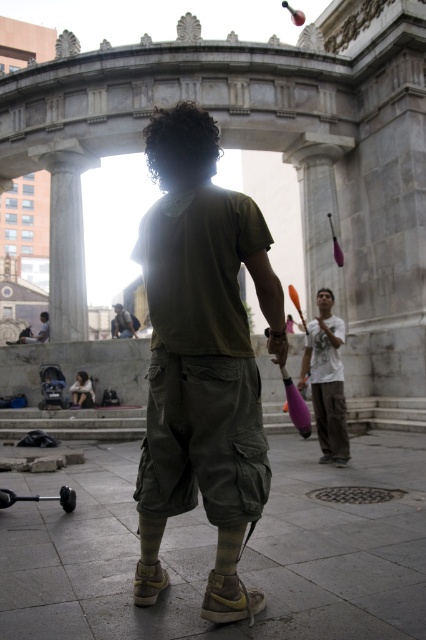
Between curly hair at center and white cotton shirt at center, which one appears on the left side from the viewer's perspective?

curly hair at center

Who is more distant from viewer, [181,161] or [325,339]?

The point [325,339] is more distant.

Locate an element on the screen. The height and width of the screenshot is (640, 426). curly hair at center is located at coordinates (181, 147).

Between point (391, 436) and point (340, 429), which one is positioned in front?

Positioned in front is point (340, 429).

Measure the distance between concrete tiles at center and camera.

concrete tiles at center is 14.95 meters from camera.

At what (x,y) coordinates should I click in order to perform the action: click on concrete tiles at center. Please return your answer as a coordinate pair (x, y). This screenshot has width=426, height=640. Looking at the image, I should click on (215, 548).

Can you confirm if matte green t-shirt at center is positioned below white cotton shirt at center?

No.

Is matte green t-shirt at center to the right of white cotton shirt at center from the viewer's perspective?

Incorrect, matte green t-shirt at center is not on the right side of white cotton shirt at center.

Does point (215, 256) lie in front of point (331, 372)?

Yes, point (215, 256) is closer to viewer.

Identify the location of matte green t-shirt at center. (201, 358).